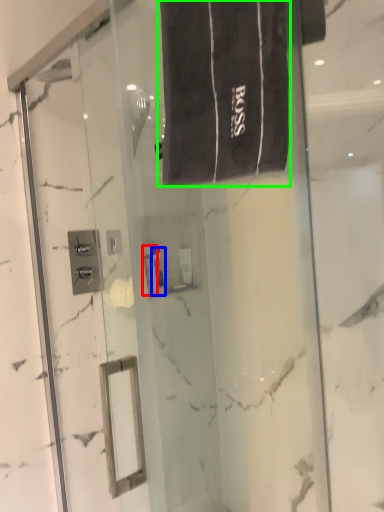
Question: Estimate the real-world distances between objects in this image. Which object is farther from toiletry (highlighted by a red box), toiletry (highlighted by a blue box) or bath towel (highlighted by a green box)?

Choices:
 (A) toiletry
 (B) bath towel

Answer: (B)